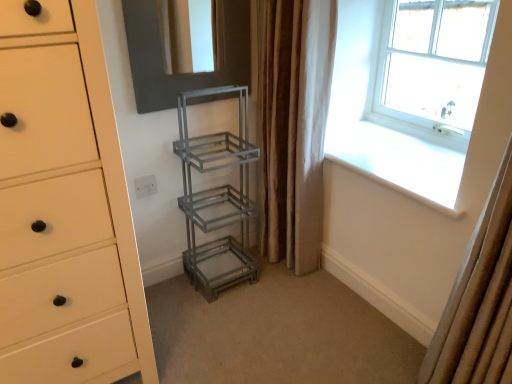
Identify the location of clear glass window at upper right. The width and height of the screenshot is (512, 384). (435, 59).

What do you see at coordinates (435, 59) in the screenshot?
I see `clear glass window at upper right` at bounding box center [435, 59].

What do you see at coordinates (185, 73) in the screenshot?
I see `matte black mirror at upper center` at bounding box center [185, 73].

Describe the element at coordinates (217, 194) in the screenshot. I see `metallic gray shelf at center` at that location.

The width and height of the screenshot is (512, 384). What are the coordinates of `beige fabric curtain at right, positioned as the first curtain in front-to-back order` in the screenshot? It's located at (479, 300).

The height and width of the screenshot is (384, 512). Describe the element at coordinates (479, 300) in the screenshot. I see `beige fabric curtain at right, which is the first curtain from right to left` at that location.

Image resolution: width=512 pixels, height=384 pixels. In order to click on matte white chest of drawers at left in this screenshot , I will do `click(82, 160)`.

The height and width of the screenshot is (384, 512). Describe the element at coordinates (293, 125) in the screenshot. I see `brown textured curtain at right, which appears as the 1th curtain when viewed from the back` at that location.

At what (x,y) coordinates should I click in order to perform the action: click on brown textured curtain at right, the 1th curtain viewed from the left. Please return your answer as a coordinate pair (x, y). Looking at the image, I should click on (293, 125).

Image resolution: width=512 pixels, height=384 pixels. Find the location of `clear glass window at upper right`. clear glass window at upper right is located at coordinates (435, 59).

Is metallic gray shelving unit at center turned away from matte black mirror at upper center?

A: No.

Does metallic gray shelving unit at center have a greater width compared to matte black mirror at upper center?

Yes.

This screenshot has height=384, width=512. What are the coordinates of `plain that appears on the right of matte black mirror at upper center` in the screenshot? It's located at (277, 333).

Which object is more forward, metallic gray shelving unit at center or matte black mirror at upper center?

metallic gray shelving unit at center is more forward.

How much distance is there between metallic gray shelf at center and matte white chest of drawers at left?

metallic gray shelf at center and matte white chest of drawers at left are 26.74 inches apart.

Can you confirm if metallic gray shelf at center is taller than matte white chest of drawers at left?

No, metallic gray shelf at center is not taller than matte white chest of drawers at left.

Consider the image. Which object is positioned more to the right, metallic gray shelf at center or matte white chest of drawers at left?

metallic gray shelf at center is more to the right.

In the image, there is a matte white chest of drawers at left. Identify the location of shelf above it (from the image's perspective). The width and height of the screenshot is (512, 384). (217, 194).

Is point (201, 193) positioned after point (167, 96)?

Yes, point (201, 193) is behind point (167, 96).

Is metallic gray shelf at center touching matte black mirror at upper center?

No, metallic gray shelf at center is not making contact with matte black mirror at upper center.

Looking at this image, would you say matte black mirror at upper center is part of metallic gray shelf at center's contents?

No, matte black mirror at upper center is located outside of metallic gray shelf at center.

From a real-world perspective, who is located lower, matte black mirror at upper center or metallic gray shelving unit at center?

metallic gray shelving unit at center, from a real-world perspective.

Considering the positions of objects matte black mirror at upper center and metallic gray shelving unit at center in the image provided, who is more to the right, matte black mirror at upper center or metallic gray shelving unit at center?

metallic gray shelving unit at center is more to the right.

Which is in front, matte black mirror at upper center or metallic gray shelving unit at center?

metallic gray shelving unit at center is closer to the camera.

Considering the positions of objects clear glass window at upper right and brown textured curtain at right, which appears as the 1th curtain when viewed from the back, in the image provided, who is more to the left, clear glass window at upper right or brown textured curtain at right, which appears as the 1th curtain when viewed from the back,?

brown textured curtain at right, which appears as the 1th curtain when viewed from the back, is more to the left.

Do you think clear glass window at upper right is within brown textured curtain at right, positioned as the second curtain in front-to-back order, or outside of it?

clear glass window at upper right is not inside brown textured curtain at right, positioned as the second curtain in front-to-back order, it's outside.

Is there a large distance between clear glass window at upper right and brown textured curtain at right, positioned as the second curtain in front-to-back order?

No, clear glass window at upper right is not far away from brown textured curtain at right, positioned as the second curtain in front-to-back order.

Is clear glass window at upper right oriented towards brown textured curtain at right, marked as the 2th curtain in a right-to-left arrangement?

Yes, clear glass window at upper right is aimed at brown textured curtain at right, marked as the 2th curtain in a right-to-left arrangement.

Is matte white chest of drawers at left in front of or behind clear glass window at upper right in the image?

matte white chest of drawers at left is in front of clear glass window at upper right.

From a real-world perspective, who is located higher, matte white chest of drawers at left or clear glass window at upper right?

clear glass window at upper right is physically above.

In terms of width, does matte white chest of drawers at left look wider or thinner when compared to clear glass window at upper right?

Clearly, matte white chest of drawers at left has more width compared to clear glass window at upper right.

Is matte white chest of drawers at left to the left of clear glass window at upper right from the viewer's perspective?

Correct, you'll find matte white chest of drawers at left to the left of clear glass window at upper right.

The image size is (512, 384). In order to click on plain located below the beige fabric curtain at right, the 2th curtain positioned from the left (from the image's perspective) in this screenshot , I will do `click(277, 333)`.

Between beige fabric curtain at right, the 2th curtain positioned from the left, and metallic gray shelving unit at center, which one appears on the left side from the viewer's perspective?

From the viewer's perspective, metallic gray shelving unit at center appears more on the left side.

Is beige fabric curtain at right, positioned as the first curtain in front-to-back order, not within metallic gray shelving unit at center?

beige fabric curtain at right, positioned as the first curtain in front-to-back order, is positioned outside metallic gray shelving unit at center.

This screenshot has width=512, height=384. Find the location of `screen door on the left of metallic gray shelving unit at center`. screen door on the left of metallic gray shelving unit at center is located at coordinates (185, 73).

Image resolution: width=512 pixels, height=384 pixels. Identify the location of shelf that is behind the matte white chest of drawers at left. coord(217,194).

Which object lies further to the anchor point matte black mirror at upper center, matte white chest of drawers at left or metallic gray shelf at center?

The object further to matte black mirror at upper center is matte white chest of drawers at left.

Based on their spatial positions, is brown textured curtain at right, marked as the 2th curtain in a right-to-left arrangement, or metallic gray shelf at center closer to clear glass window at upper right?

The object closer to clear glass window at upper right is brown textured curtain at right, marked as the 2th curtain in a right-to-left arrangement.

Based on their spatial positions, is clear glass window at upper right or matte black mirror at upper center further from brown textured curtain at right, which appears as the 1th curtain when viewed from the back?

clear glass window at upper right.

Based on the photo, estimate the real-world distances between objects in this image. Which object is further from clear glass window at upper right, matte black mirror at upper center or metallic gray shelving unit at center?

Among the two, metallic gray shelving unit at center is located further to clear glass window at upper right.

From the image, which object appears to be nearer to brown textured curtain at right, positioned as the second curtain in front-to-back order, matte white chest of drawers at left or metallic gray shelf at center?

The object closer to brown textured curtain at right, positioned as the second curtain in front-to-back order, is metallic gray shelf at center.

Estimate the real-world distances between objects in this image. Which object is further from clear glass window at upper right, metallic gray shelving unit at center or brown textured curtain at right, positioned as the second curtain in front-to-back order?

Among the two, metallic gray shelving unit at center is located further to clear glass window at upper right.

Estimate the real-world distances between objects in this image. Which object is further from metallic gray shelving unit at center, beige fabric curtain at right, which is the 2th curtain from back to front, or metallic gray shelf at center?

Among the two, beige fabric curtain at right, which is the 2th curtain from back to front, is located further to metallic gray shelving unit at center.

Based on their spatial positions, is matte white chest of drawers at left or clear glass window at upper right closer to matte black mirror at upper center?

The object closer to matte black mirror at upper center is matte white chest of drawers at left.

Image resolution: width=512 pixels, height=384 pixels. Identify the location of plain between matte white chest of drawers at left and metallic gray shelf at center in the front-back direction. (277, 333).

You are a GUI agent. You are given a task and a screenshot of the screen. Output one action in this format:
    pyautogui.click(x=<x>, y=<y>)
    Task: Click on the plain between matte white chest of drawers at left and brown textured curtain at right, positioned as the second curtain in front-to-back order
    The image size is (512, 384).
    Given the screenshot: What is the action you would take?
    pyautogui.click(x=277, y=333)

Where is `curtain between beige fabric curtain at right, which is the first curtain from right to left, and clear glass window at upper right, along the z-axis`? The width and height of the screenshot is (512, 384). curtain between beige fabric curtain at right, which is the first curtain from right to left, and clear glass window at upper right, along the z-axis is located at coordinates (293, 125).

At what (x,y) coordinates should I click in order to perform the action: click on curtain between matte white chest of drawers at left and beige fabric curtain at right, positioned as the first curtain in front-to-back order. Please return your answer as a coordinate pair (x, y). Image resolution: width=512 pixels, height=384 pixels. Looking at the image, I should click on (293, 125).